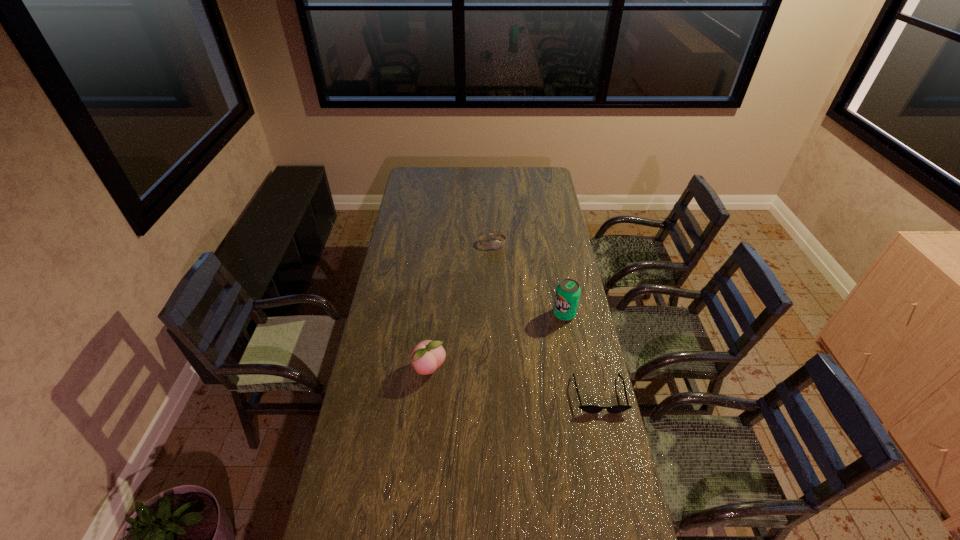
Identify the location of free spot between the second shortest object and the second tallest object. The image size is (960, 540). [x=461, y=307].

The width and height of the screenshot is (960, 540). In order to click on free spot between the tallest object and the shortest object in this screenshot , I will do `click(582, 354)`.

Choose which object is the second nearest neighbor to the second farthest object. Please provide its 2D coordinates. Your answer should be formatted as a tuple, i.e. [(x, y)], where the tuple contains the x and y coordinates of a point satisfying the conditions above.

[(496, 244)]

Identify which object is located as the third nearest to the third nearest object. Please provide its 2D coordinates. Your answer should be formatted as a tuple, i.e. [(x, y)], where the tuple contains the x and y coordinates of a point satisfying the conditions above.

[(427, 356)]

This screenshot has width=960, height=540. In order to click on vacant region that satisfies the following two spatial constraints: 1. on the back side of the third shortest object; 2. on the right side of the watch in this screenshot , I will do `click(442, 244)`.

Where is `vacant space that satisfies the following two spatial constraints: 1. on the back side of the pop soda; 2. on the right side of the leftmost object`? vacant space that satisfies the following two spatial constraints: 1. on the back side of the pop soda; 2. on the right side of the leftmost object is located at coordinates (435, 314).